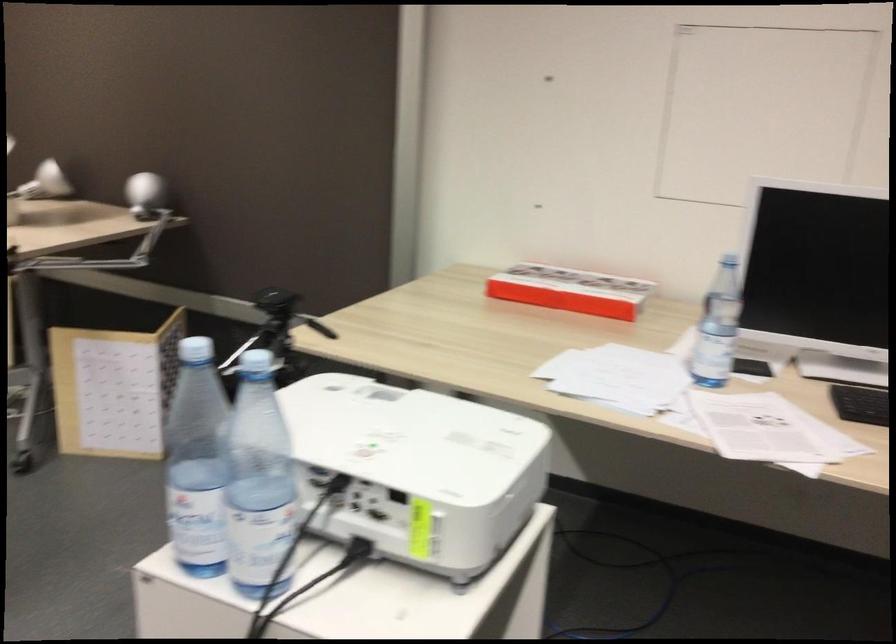
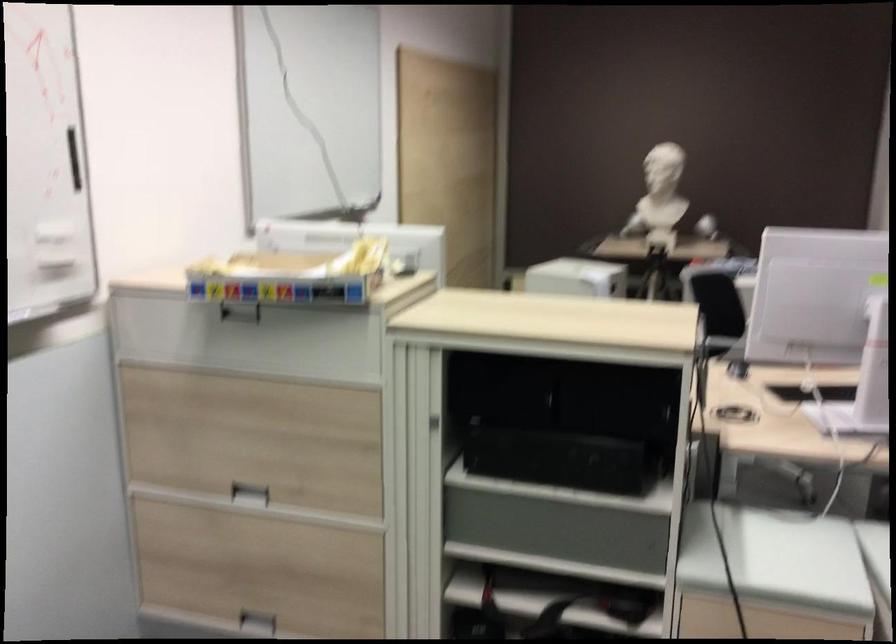
Question: I am providing you with two images of the same scene from different viewpoints. Which of the following objects are not visible in image2?

Choices:
 (A) projector lens ring
 (B) green glass cup
 (C) recessed drawer handle
 (D) black box handle

Answer: (A)